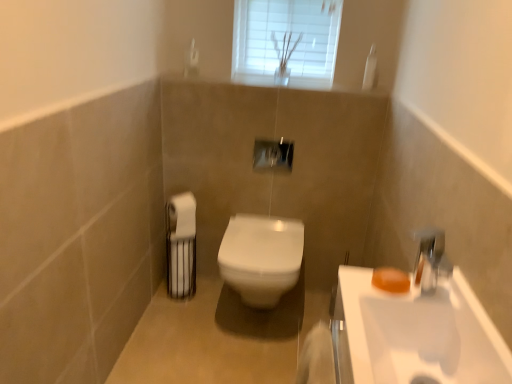
Where is `free location to the right of orange matte soap at right`? Image resolution: width=512 pixels, height=384 pixels. free location to the right of orange matte soap at right is located at coordinates (430, 290).